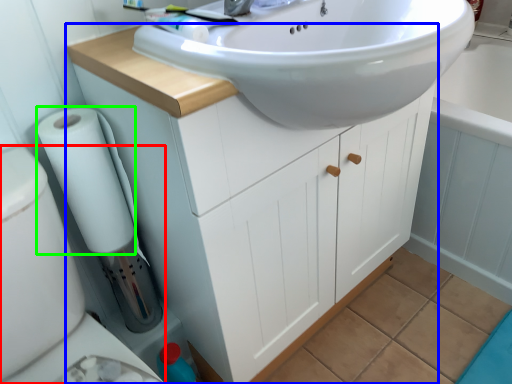
Question: Estimate the real-world distances between objects in this image. Which object is farther from bidet (highlighted by a red box), bathroom cabinet (highlighted by a blue box) or toilet paper (highlighted by a green box)?

Choices:
 (A) bathroom cabinet
 (B) toilet paper

Answer: (A)